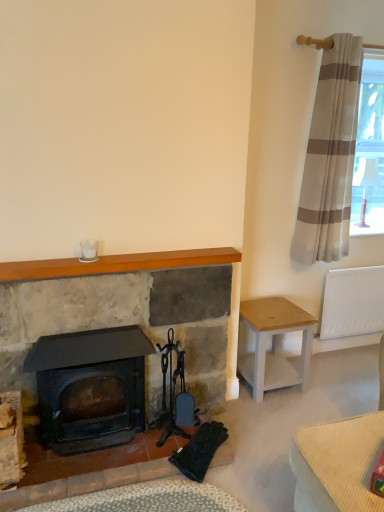
Locate an element on the screen. unoccupied region to the right of white glass at upper center is located at coordinates (116, 262).